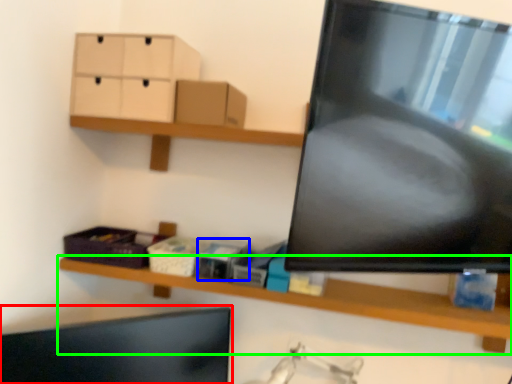
Question: Considering the real-world distances, which object is closest to computer monitor (highlighted by a red box)? storage box (highlighted by a blue box) or shelf (highlighted by a green box).

Choices:
 (A) storage box
 (B) shelf

Answer: (B)